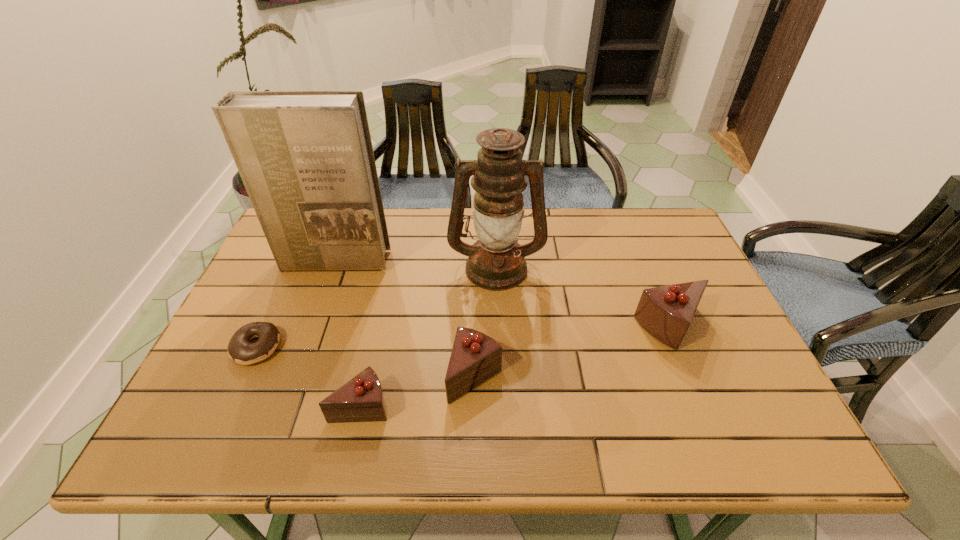
In order to click on the fifth tallest object in this screenshot , I will do `click(361, 399)`.

You are a GUI agent. You are given a task and a screenshot of the screen. Output one action in this format:
    pyautogui.click(x=<x>, y=<y>)
    Task: Click on the shortest chocolate cake
    The image size is (960, 540).
    Given the screenshot: What is the action you would take?
    pyautogui.click(x=361, y=399)

At what (x,y) coordinates should I click in order to perform the action: click on the third shortest object. Please return your answer as a coordinate pair (x, y). This screenshot has height=540, width=960. Looking at the image, I should click on (475, 357).

The height and width of the screenshot is (540, 960). I want to click on the second chocolate cake from right to left, so click(x=475, y=357).

The width and height of the screenshot is (960, 540). What are the coordinates of `the rightmost chocolate cake` in the screenshot? It's located at (666, 312).

Identify the location of phonebook. (306, 159).

You are a GUI agent. You are given a task and a screenshot of the screen. Output one action in this format:
    pyautogui.click(x=<x>, y=<y>)
    Task: Click on the lantern
    
    Given the screenshot: What is the action you would take?
    [x=496, y=262]

The width and height of the screenshot is (960, 540). I want to click on the shortest object, so [x=240, y=350].

At what (x,y) coordinates should I click in order to perform the action: click on blank space located on the right of the second shortest object. Please return your answer as a coordinate pair (x, y). Image resolution: width=960 pixels, height=540 pixels. Looking at the image, I should click on (542, 404).

The width and height of the screenshot is (960, 540). What are the coordinates of `vacant space situated on the back of the second tallest chocolate cake` in the screenshot? It's located at [476, 294].